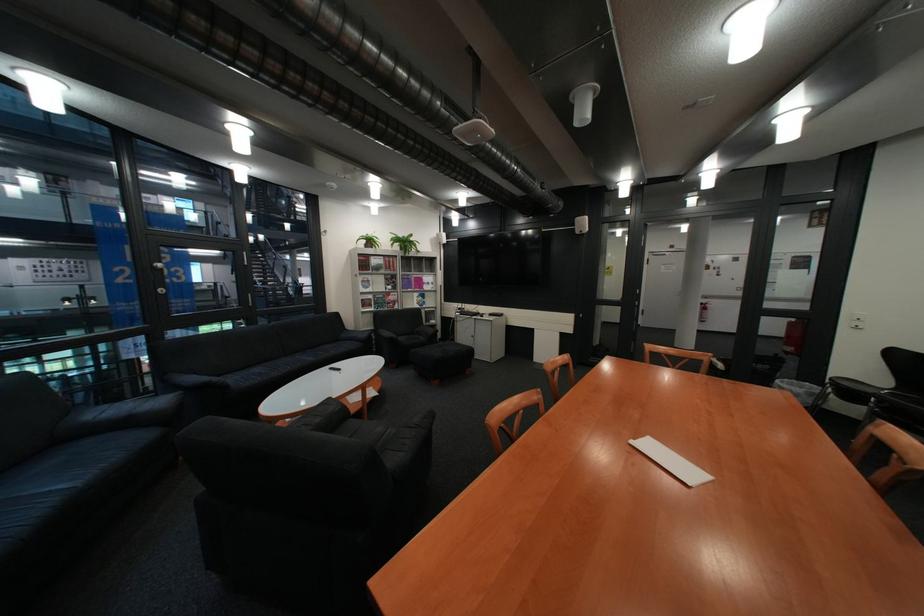
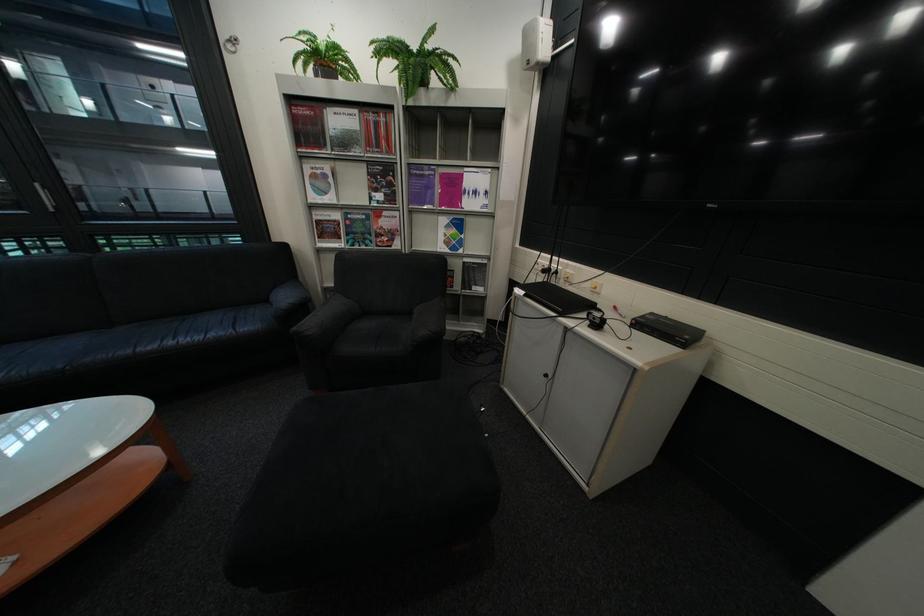
In the second image, find the point that corresponds to point (475, 309) in the first image.

(563, 270)